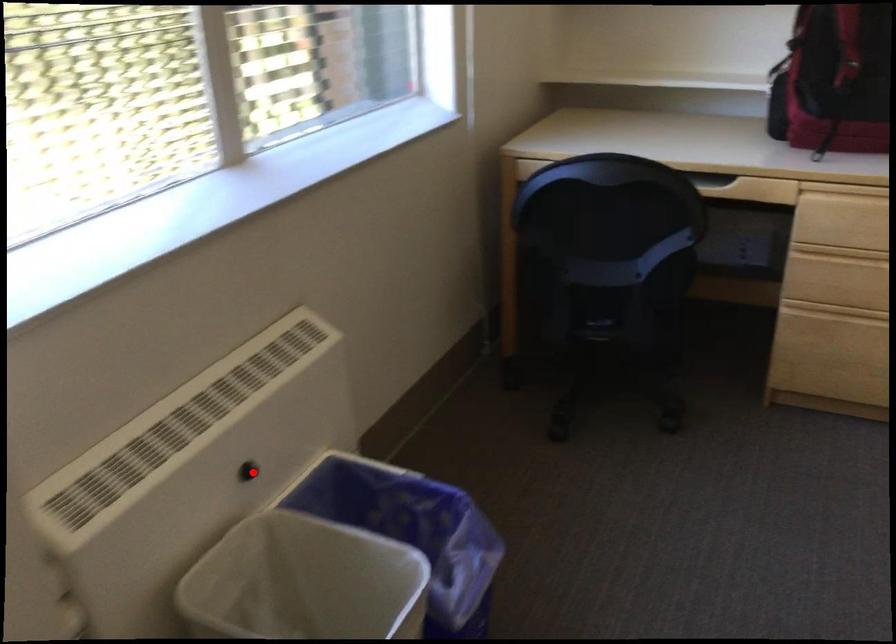
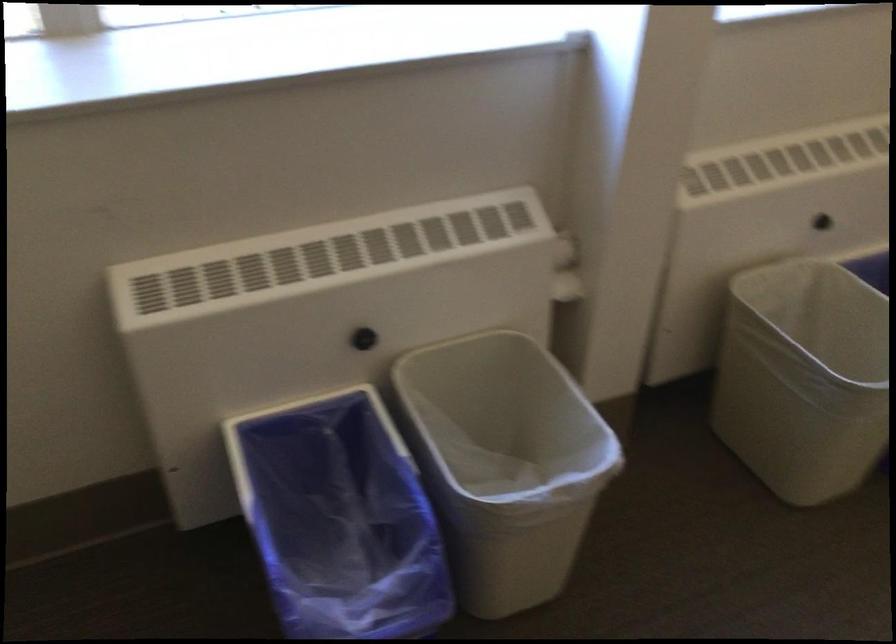
Locate, in the second image, the point that corresponds to the highlighted location in the first image.

(821, 222)